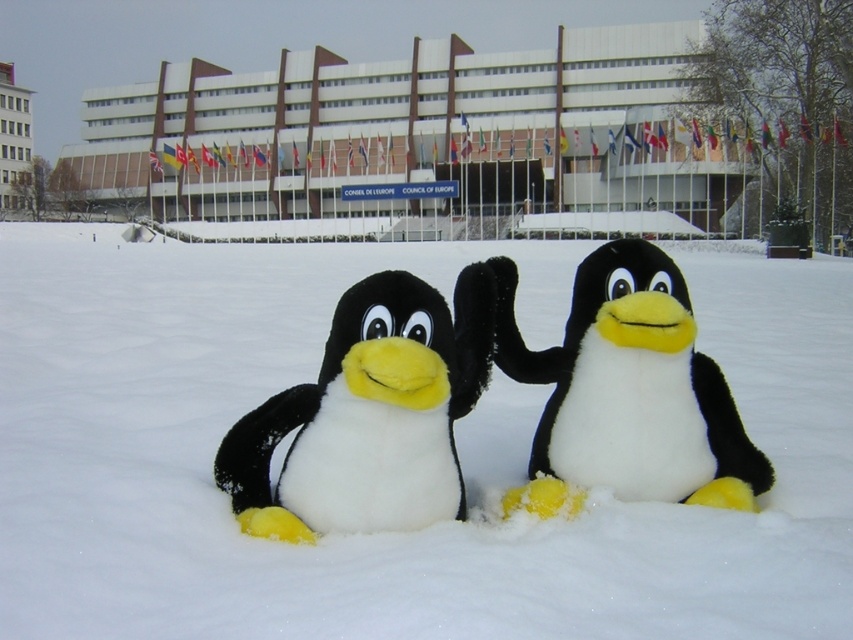
From the picture: Who is shorter, white fluffy snow at center or white plush penguin at center?

Standing shorter between the two is white plush penguin at center.

Does white fluffy snow at center have a lesser width compared to white plush penguin at center?

No.

This screenshot has height=640, width=853. What do you see at coordinates (456, 442) in the screenshot?
I see `white fluffy snow at center` at bounding box center [456, 442].

The width and height of the screenshot is (853, 640). Identify the location of white fluffy snow at center. (456, 442).

Who is lower down, white fluffy snow at center or fluffy black-and-white penguin at center?

fluffy black-and-white penguin at center is lower down.

Which of these two, white fluffy snow at center or fluffy black-and-white penguin at center, stands taller?

white fluffy snow at center is taller.

What are the coordinates of `white fluffy snow at center` in the screenshot? It's located at (456, 442).

Find the location of a particular element. This screenshot has height=640, width=853. white fluffy snow at center is located at coordinates (456, 442).

Looking at this image, does white plush penguin at center have a smaller size compared to fluffy black-and-white penguin at center?

Incorrect, white plush penguin at center is not smaller in size than fluffy black-and-white penguin at center.

Which of these two, white plush penguin at center or fluffy black-and-white penguin at center, stands shorter?

Standing shorter between the two is white plush penguin at center.

What are the coordinates of `white plush penguin at center` in the screenshot? It's located at (369, 413).

I want to click on white plush penguin at center, so click(369, 413).